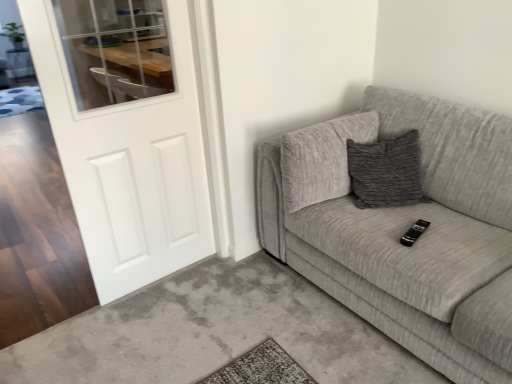
Question: Could you tell me if textured gray couch at right is facing white matte door at left?

Choices:
 (A) no
 (B) yes

Answer: (B)

Question: Can you confirm if textured gray couch at right is smaller than white matte door at left?

Choices:
 (A) no
 (B) yes

Answer: (A)

Question: Considering the relative sizes of textured gray couch at right and white matte door at left in the image provided, is textured gray couch at right wider than white matte door at left?

Choices:
 (A) no
 (B) yes

Answer: (B)

Question: Is textured gray couch at right completely or partially outside of white matte door at left?

Choices:
 (A) yes
 (B) no

Answer: (A)

Question: Can you confirm if textured gray couch at right is thinner than white matte door at left?

Choices:
 (A) no
 (B) yes

Answer: (A)

Question: Does textured gray couch at right appear on the left side of white matte door at left?

Choices:
 (A) no
 (B) yes

Answer: (A)

Question: From the image's perspective, is white matte door at left on top of textured gray couch at right?

Choices:
 (A) yes
 (B) no

Answer: (A)

Question: Does white matte door at left have a lesser height compared to textured gray couch at right?

Choices:
 (A) no
 (B) yes

Answer: (A)

Question: Is white matte door at left bigger than textured gray couch at right?

Choices:
 (A) no
 (B) yes

Answer: (A)

Question: Is white matte door at left positioned before textured gray couch at right?

Choices:
 (A) yes
 (B) no

Answer: (B)

Question: Is white matte door at left thinner than textured gray couch at right?

Choices:
 (A) yes
 (B) no

Answer: (A)

Question: From the image's perspective, would you say white matte door at left is shown under textured gray couch at right?

Choices:
 (A) no
 (B) yes

Answer: (A)

Question: Considering the relative positions of textured gray couch at right and black plastic remote at center in the image provided, is textured gray couch at right to the right of black plastic remote at center from the viewer's perspective?

Choices:
 (A) yes
 (B) no

Answer: (A)